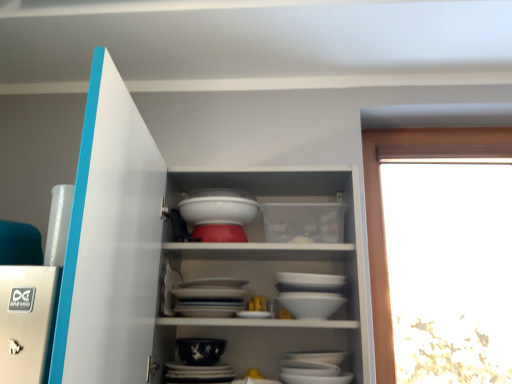
Question: From a real-world perspective, relative to white glossy cupboard at center, is dark blue porcelain bowl at center vertically above or below?

Choices:
 (A) below
 (B) above

Answer: (A)

Question: Would you say dark blue porcelain bowl at center is to the left or to the right of white glossy cupboard at center in the picture?

Choices:
 (A) left
 (B) right

Answer: (A)

Question: Which object is the closest to the white glossy bowl at center?

Choices:
 (A) white glossy cupboard at center
 (B) dark blue porcelain bowl at center

Answer: (A)

Question: Based on their relative distances, which object is nearer to the dark blue porcelain bowl at center?

Choices:
 (A) white glossy bowl at center
 (B) white glossy cupboard at center

Answer: (A)